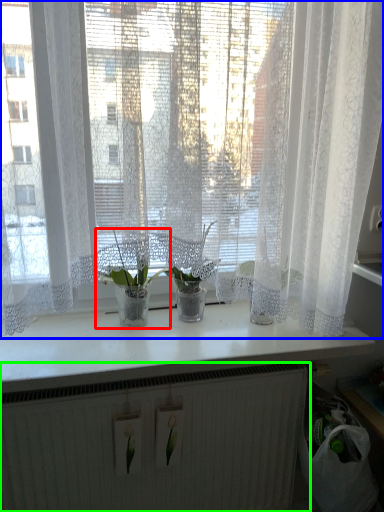
Question: Which is farther away from houseplant (highlighted by a red box)? curtain (highlighted by a blue box) or radiator (highlighted by a green box)?

Choices:
 (A) curtain
 (B) radiator

Answer: (B)